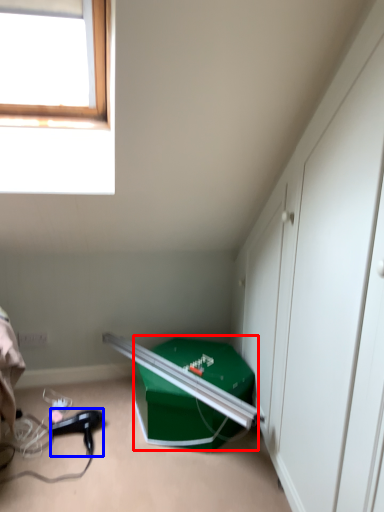
Question: Among these objects, which one is farthest to the camera, box (highlighted by a red box) or hair drier (highlighted by a blue box)?

Choices:
 (A) box
 (B) hair drier

Answer: (B)